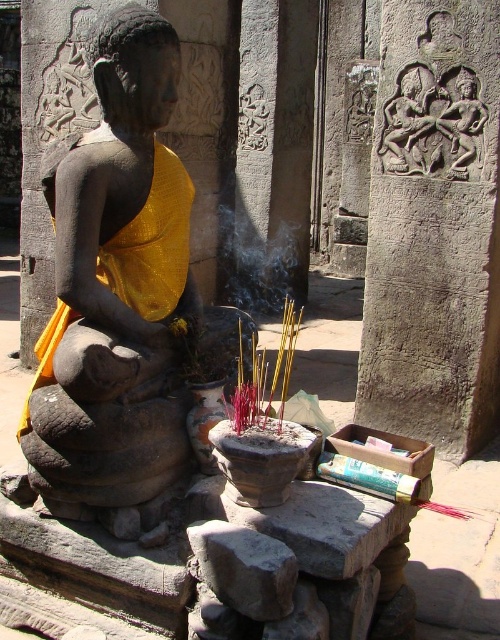
Between yellow fabric at center and smoketransparent at center, which one has more height?

Standing taller between the two is smoketransparent at center.

The image size is (500, 640). I want to click on yellow fabric at center, so click(x=153, y=243).

Between point (150, 289) and point (242, 209), which one is positioned in front?

Point (150, 289)

Where is `yellow fabric at center`? yellow fabric at center is located at coordinates (153, 243).

Which is above, matte stone statue at center or carved stone figure at upper right?

carved stone figure at upper right

What do you see at coordinates (120, 208) in the screenshot?
I see `matte stone statue at center` at bounding box center [120, 208].

Where is `matte stone statue at center`? matte stone statue at center is located at coordinates (120, 208).

Between carved stone relief at upper right and smoketransparent at center, which one has less height?

smoketransparent at center is shorter.

You are a GUI agent. You are given a task and a screenshot of the screen. Output one action in this format:
    pyautogui.click(x=<x>, y=<y>)
    Task: Click on the carved stone relief at upper right
    The width and height of the screenshot is (500, 640).
    Given the screenshot: What is the action you would take?
    pyautogui.click(x=434, y=227)